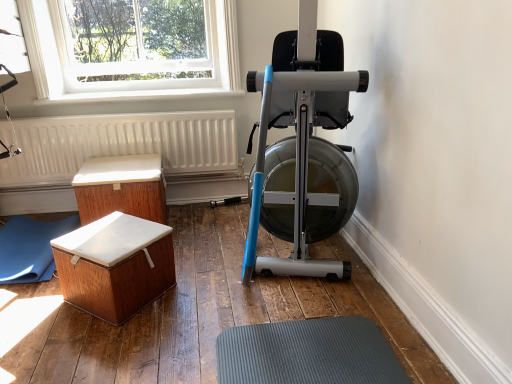
This screenshot has height=384, width=512. I want to click on free space between wooden chest at lower left, marked as the 2th furniture in a back-to-front arrangement, and silver metallic stationary bicycle at center, so click(x=211, y=268).